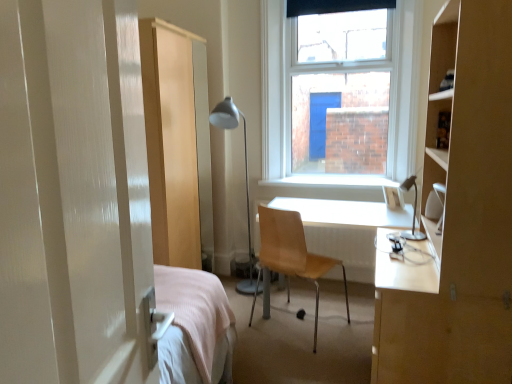
Question: Is wooden chair at center oriented towards white glossy desk at center?

Choices:
 (A) yes
 (B) no

Answer: (A)

Question: Is wooden chair at center facing away from white glossy desk at center?

Choices:
 (A) no
 (B) yes

Answer: (B)

Question: Does wooden chair at center appear on the left side of white glossy desk at center?

Choices:
 (A) no
 (B) yes

Answer: (B)

Question: Does wooden chair at center have a lesser height compared to white glossy desk at center?

Choices:
 (A) yes
 (B) no

Answer: (B)

Question: From the image's perspective, is wooden chair at center below white glossy desk at center?

Choices:
 (A) no
 (B) yes

Answer: (A)

Question: Considering the relative positions of white glossy desk at center and matte silver table lamp at right, the 1th table lamp viewed from the right, in the image provided, is white glossy desk at center to the left or to the right of matte silver table lamp at right, the 1th table lamp viewed from the right,?

Choices:
 (A) right
 (B) left

Answer: (B)

Question: From the image's perspective, is white glossy desk at center located above or below matte silver table lamp at right, the 1th table lamp viewed from the right?

Choices:
 (A) below
 (B) above

Answer: (A)

Question: Is white glossy desk at center inside the boundaries of matte silver table lamp at right, the 2th table lamp viewed from the back, or outside?

Choices:
 (A) inside
 (B) outside

Answer: (B)

Question: Looking at their shapes, would you say white glossy desk at center is wider or thinner than matte silver table lamp at right, arranged as the 1th table lamp when viewed from the front?

Choices:
 (A) thin
 (B) wide

Answer: (B)

Question: From a real-world perspective, is white smooth window sill at center physically located above or below matte silver floor lamp at center, the second table lamp in the front-to-back sequence?

Choices:
 (A) above
 (B) below

Answer: (A)

Question: Is point (300, 183) closer or farther from the camera than point (218, 117)?

Choices:
 (A) farther
 (B) closer

Answer: (A)

Question: Is white smooth window sill at center bigger or smaller than matte silver floor lamp at center, which is counted as the 1th table lamp, starting from the back?

Choices:
 (A) small
 (B) big

Answer: (A)

Question: In terms of width, does white smooth window sill at center look wider or thinner when compared to matte silver floor lamp at center, which is the 2th table lamp from right to left?

Choices:
 (A) wide
 (B) thin

Answer: (B)

Question: Based on their sizes in the image, would you say white glossy desk at center is bigger or smaller than matte silver floor lamp at center, which is the 2th table lamp from right to left?

Choices:
 (A) big
 (B) small

Answer: (A)

Question: From a real-world perspective, is white glossy desk at center above or below matte silver floor lamp at center, the second table lamp in the front-to-back sequence?

Choices:
 (A) below
 (B) above

Answer: (A)